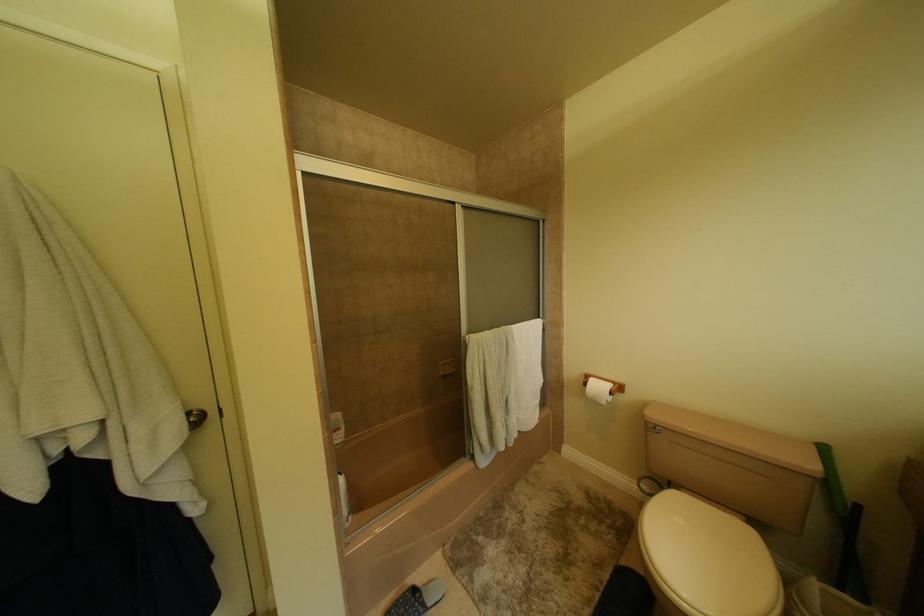
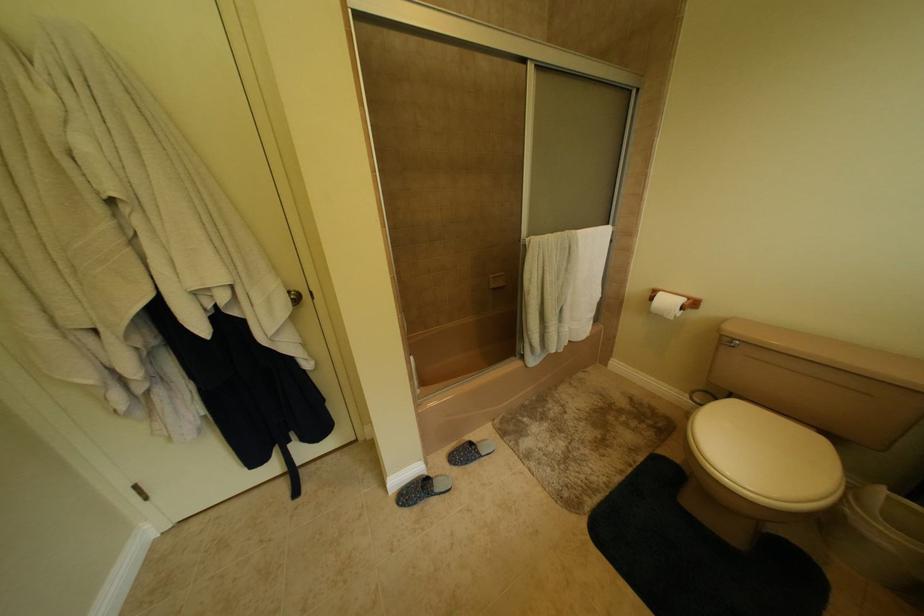
Question: The images are taken continuously from a first-person perspective. In which direction are you moving?

Choices:
 (A) Left
 (B) Right
 (C) Forward
 (D) Backward

Answer: (A)